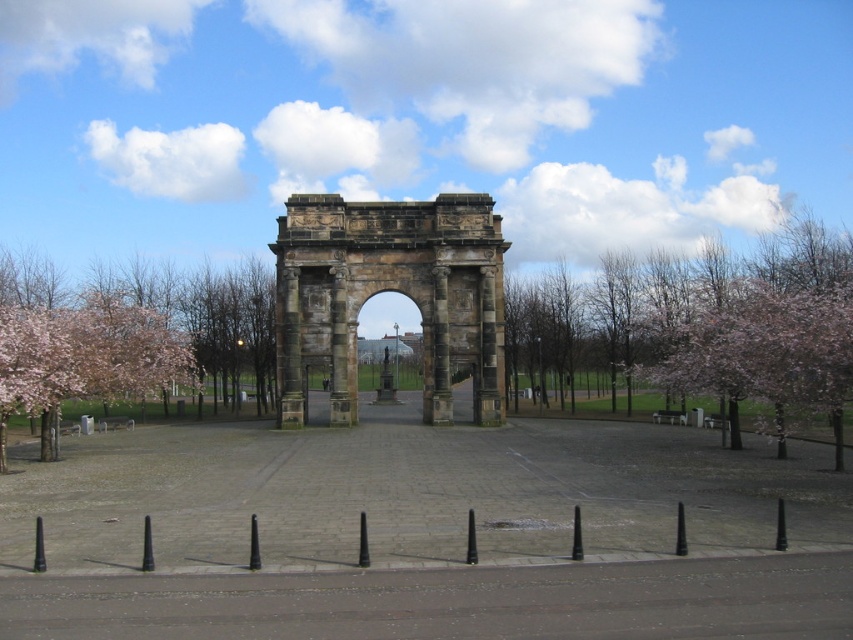
You are a gardener planning to place a new decorative statue in the park. You want to ensure it fits between the two sets of pink blossoms at right and pink blossoms at left. Based on the scene, can you determine if the space between them is wide enough for a statue that is 1.2 meters wide?

The pink blossoms at right might be wider than pink blossoms at left, but without exact measurements, it is uncertain if the space between them can accommodate a 1.2 meter wide statue. Further measurement is recommended.